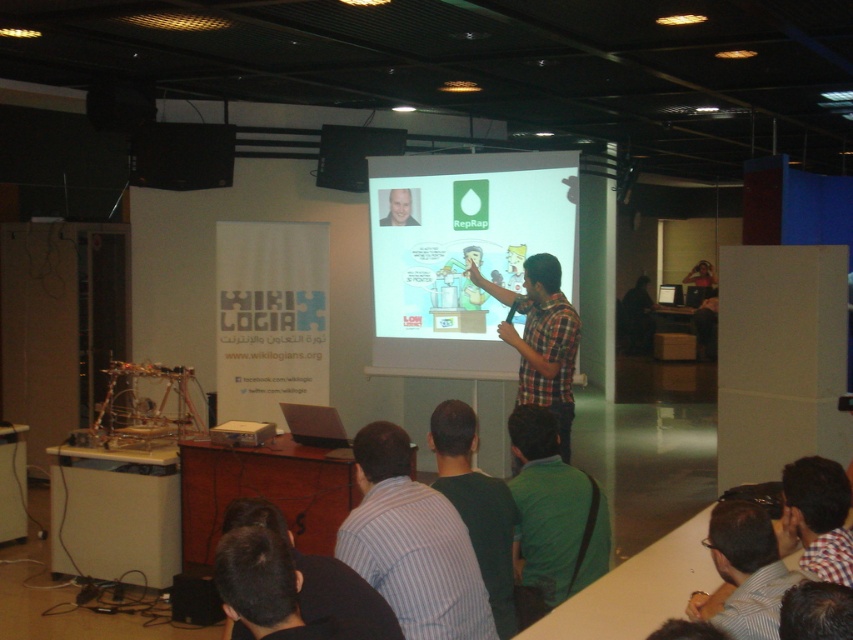
Question: Which of the following is the farthest from the observer?

Choices:
 (A) white matte projection screen at center
 (B) dark green shirt at center
 (C) checkered fabric shirt at lower right

Answer: (A)

Question: Estimate the real-world distances between objects in this image. Which object is closer to the matte black laptop at upper left?

Choices:
 (A) striped shirt at lower center
 (B) light blue shirt at center

Answer: (B)

Question: Observing the image, what is the correct spatial positioning of green fabric shirt at lower center in reference to light blue shirt at center?

Choices:
 (A) right
 (B) left

Answer: (A)

Question: Which of the following is the closest to the observer?

Choices:
 (A) (802, 481)
 (B) (403, 140)

Answer: (A)

Question: Does green fabric shirt at lower center appear under dark brown hair at lower center?

Choices:
 (A) no
 (B) yes

Answer: (B)

Question: Can you confirm if striped cotton shirt at center is positioned below dark green shirt at center?

Choices:
 (A) yes
 (B) no

Answer: (B)